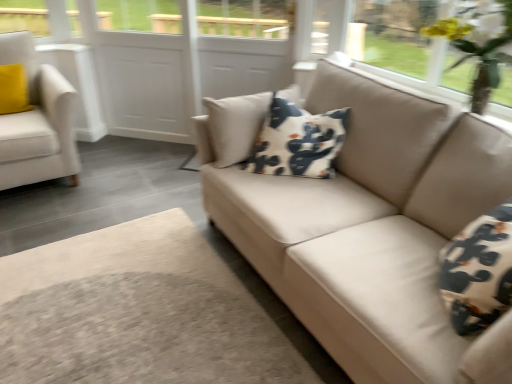
Question: Is white fabric armchair at left at the back of yellow artificial flowers at upper right?

Choices:
 (A) yes
 (B) no

Answer: (B)

Question: Does yellow artificial flowers at upper right have a greater width compared to white fabric armchair at left?

Choices:
 (A) yes
 (B) no

Answer: (B)

Question: From a real-world perspective, is yellow artificial flowers at upper right below white fabric armchair at left?

Choices:
 (A) yes
 (B) no

Answer: (B)

Question: Is yellow artificial flowers at upper right oriented towards white fabric armchair at left?

Choices:
 (A) no
 (B) yes

Answer: (A)

Question: Does yellow artificial flowers at upper right lie in front of white fabric armchair at left?

Choices:
 (A) no
 (B) yes

Answer: (B)

Question: Based on their positions, is white cotton pillow at center located to the left or right of white fabric armchair at left?

Choices:
 (A) right
 (B) left

Answer: (A)

Question: In the image, is white cotton pillow at center positioned in front of or behind white fabric armchair at left?

Choices:
 (A) front
 (B) behind

Answer: (A)

Question: In terms of width, does white cotton pillow at center look wider or thinner when compared to white fabric armchair at left?

Choices:
 (A) wide
 (B) thin

Answer: (B)

Question: Is white cotton pillow at center bigger or smaller than white fabric armchair at left?

Choices:
 (A) big
 (B) small

Answer: (B)

Question: Would you say white fabric armchair at left is to the left or to the right of white cotton pillow at center in the picture?

Choices:
 (A) right
 (B) left

Answer: (B)

Question: Considering the positions of point (32, 44) and point (301, 173), is point (32, 44) closer or farther from the camera than point (301, 173)?

Choices:
 (A) farther
 (B) closer

Answer: (A)

Question: From their relative heights in the image, would you say white fabric armchair at left is taller or shorter than white cotton pillow at center?

Choices:
 (A) tall
 (B) short

Answer: (A)

Question: Looking at the image, does white fabric armchair at left seem bigger or smaller compared to white cotton pillow at center?

Choices:
 (A) small
 (B) big

Answer: (B)

Question: Looking at their shapes, would you say beige fabric couch at center is wider or thinner than white fabric armchair at left?

Choices:
 (A) thin
 (B) wide

Answer: (B)

Question: In terms of size, does beige fabric couch at center appear bigger or smaller than white fabric armchair at left?

Choices:
 (A) big
 (B) small

Answer: (A)